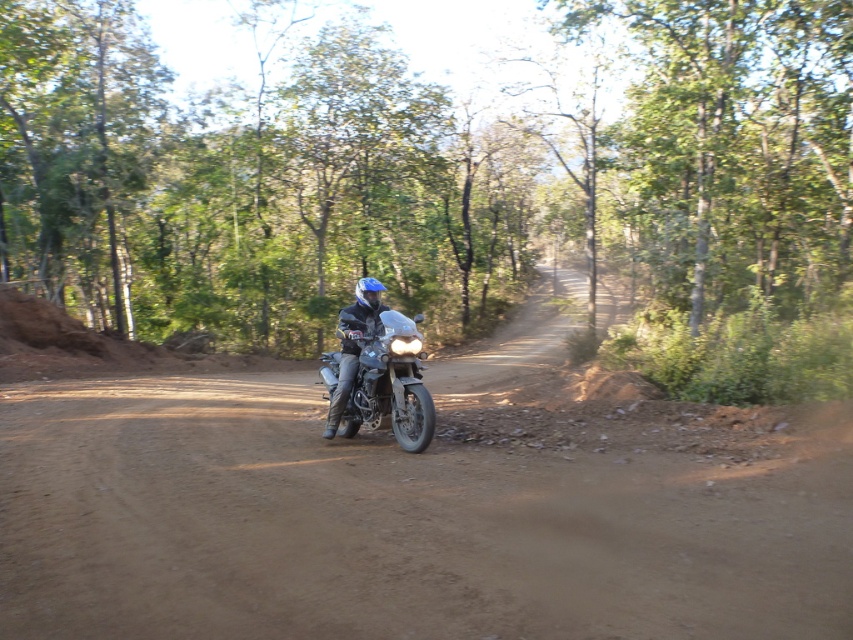
Question: Does green leafy tree at center appear over metallic silver motorcycle at center?

Choices:
 (A) no
 (B) yes

Answer: (B)

Question: Is brown dirt track at center wider than matte black motorcycle at center?

Choices:
 (A) no
 (B) yes

Answer: (B)

Question: Estimate the real-world distances between objects in this image. Which object is farther from the green leafy tree at center?

Choices:
 (A) green leafy trees at upper center
 (B) matte black motorcycle at center
 (C) brown dirt track at center

Answer: (B)

Question: Which object is farther from the camera taking this photo?

Choices:
 (A) metallic silver motorcycle at center
 (B) green leafy tree at center
 (C) brown dirt track at center
 (D) green leafy trees at upper center

Answer: (B)

Question: Observing the image, what is the correct spatial positioning of metallic silver motorcycle at center in reference to matte black motorcycle at center?

Choices:
 (A) right
 (B) left

Answer: (A)

Question: Considering the real-world distances, which object is closest to the green leafy trees at upper center?

Choices:
 (A) brown dirt track at center
 (B) green leafy tree at center
 (C) matte black motorcycle at center
 (D) metallic silver motorcycle at center

Answer: (B)